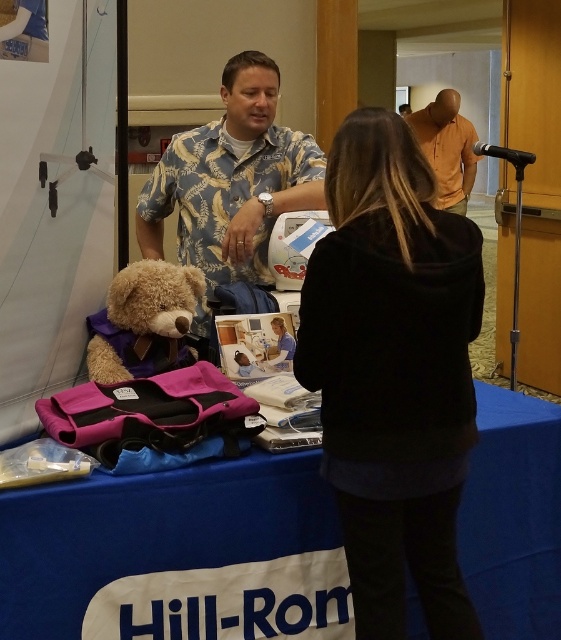
Question: Does blue fabric table at lower center appear on the left side of fuzzy brown teddy bear at center?

Choices:
 (A) no
 (B) yes

Answer: (A)

Question: Which object is positioned farthest from the blue fabric table at lower center?

Choices:
 (A) blue floral shirt at center
 (B) black fleece jacket at center

Answer: (A)

Question: Does blue fabric table at lower center have a lesser width compared to fuzzy brown teddy bear at center?

Choices:
 (A) no
 (B) yes

Answer: (A)

Question: Which object is the farthest from the black fleece jacket at center?

Choices:
 (A) fuzzy brown teddy bear at center
 (B) blue floral shirt at center

Answer: (B)

Question: Which of the following is the farthest from the observer?

Choices:
 (A) (558, 612)
 (B) (346, 340)

Answer: (A)

Question: Is blue fabric table at lower center above orange cotton shirt at upper center?

Choices:
 (A) no
 (B) yes

Answer: (A)